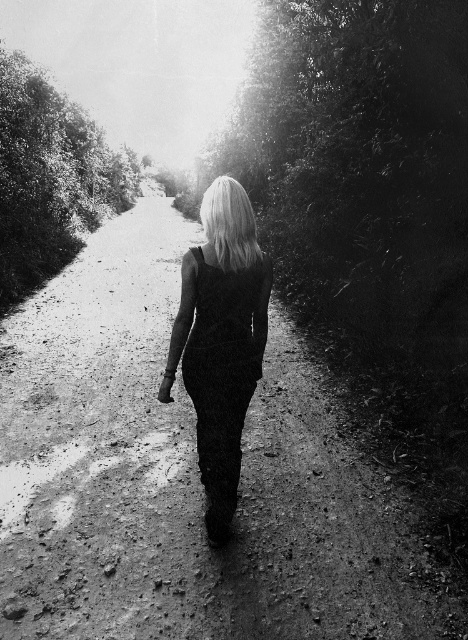
Question: Does black textured pants at center have a larger size compared to blonde hair at center?

Choices:
 (A) yes
 (B) no

Answer: (B)

Question: Which point is closer to the camera?

Choices:
 (A) (225, 380)
 (B) (209, 196)

Answer: (B)

Question: Can you confirm if black textured pants at center is thinner than blonde hair at center?

Choices:
 (A) no
 (B) yes

Answer: (B)

Question: Which point is closer to the camera?

Choices:
 (A) (234, 401)
 (B) (251, 244)

Answer: (B)

Question: Does black textured pants at center have a larger size compared to blonde hair at center?

Choices:
 (A) no
 (B) yes

Answer: (A)